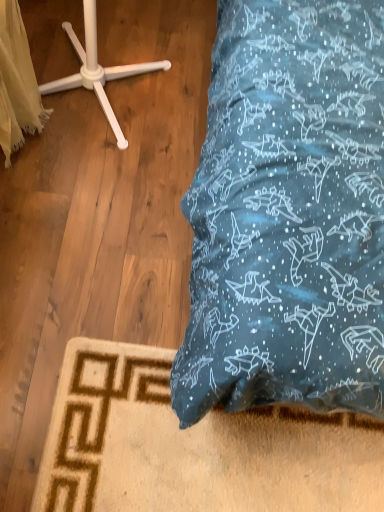
Image resolution: width=384 pixels, height=512 pixels. I want to click on vacant area located to the right-hand side of white fabric at left, so click(107, 185).